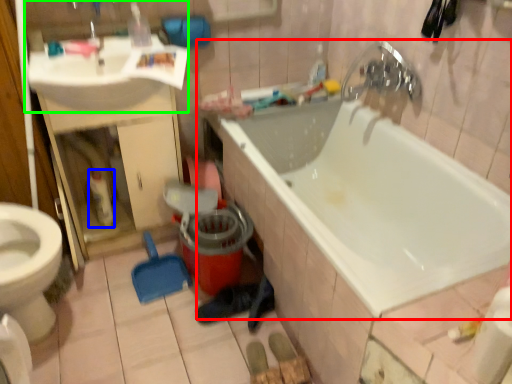
Question: Based on their relative distances, which object is nearer to bathtub (highlighted by a red box)? Choose from cleaning product (highlighted by a blue box) and sink (highlighted by a green box).

Choices:
 (A) cleaning product
 (B) sink

Answer: (B)